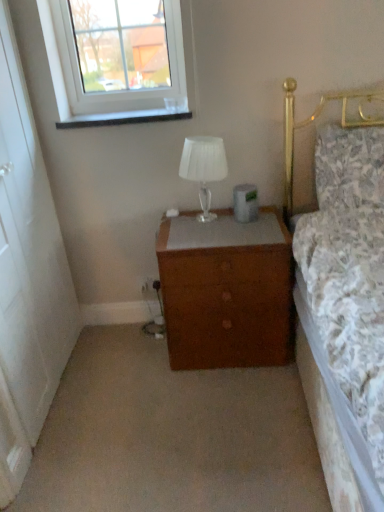
The image size is (384, 512). I want to click on space that is in front of brown wooden chest of drawers at center, so click(221, 407).